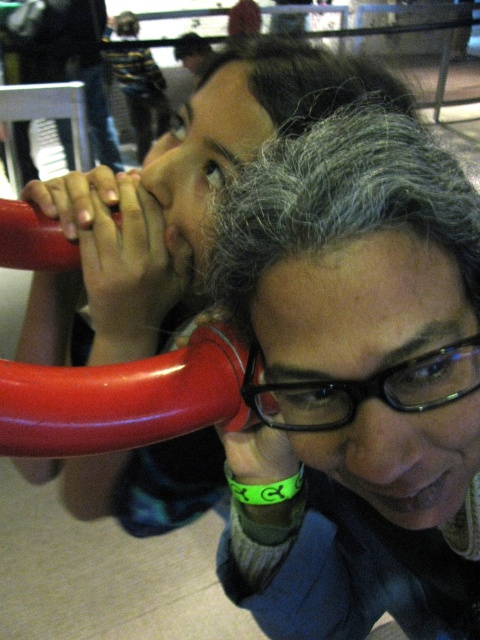
Question: Which point is farther from the camera taking this photo?

Choices:
 (A) (129, 332)
 (B) (80, 436)

Answer: (A)

Question: Can you confirm if gray hair at center is thinner than glossy red handlebar at lower center?

Choices:
 (A) no
 (B) yes

Answer: (A)

Question: Among these points, which one is nearest to the camera?

Choices:
 (A) (180, 248)
 (B) (40, 436)
 (C) (351, 410)

Answer: (C)

Question: Can you confirm if matte black hair at center is smaller than glossy red handlebar at lower center?

Choices:
 (A) yes
 (B) no

Answer: (B)

Question: Can you confirm if matte black hair at center is thinner than glossy red handlebar at lower center?

Choices:
 (A) no
 (B) yes

Answer: (A)

Question: Among these objects, which one is nearest to the camera?

Choices:
 (A) glossy red handlebar at lower center
 (B) matte black hair at center

Answer: (A)